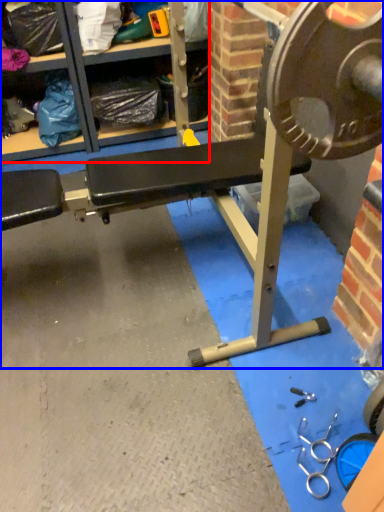
Question: Among these objects, which one is nearest to the camera, shelf (highlighted by a red box) or bench (highlighted by a blue box)?

Choices:
 (A) shelf
 (B) bench

Answer: (B)